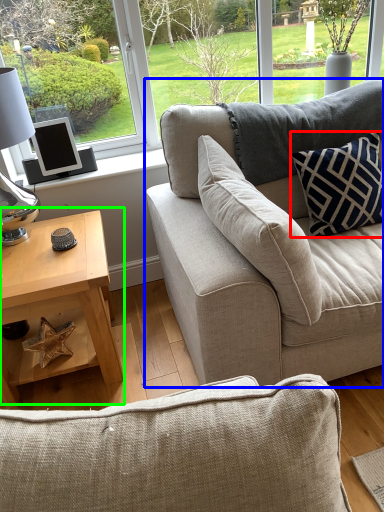
Question: Estimate the real-world distances between objects in this image. Which object is farther from pillow (highlighted by a red box), studio couch (highlighted by a blue box) or coffee table (highlighted by a green box)?

Choices:
 (A) studio couch
 (B) coffee table

Answer: (B)